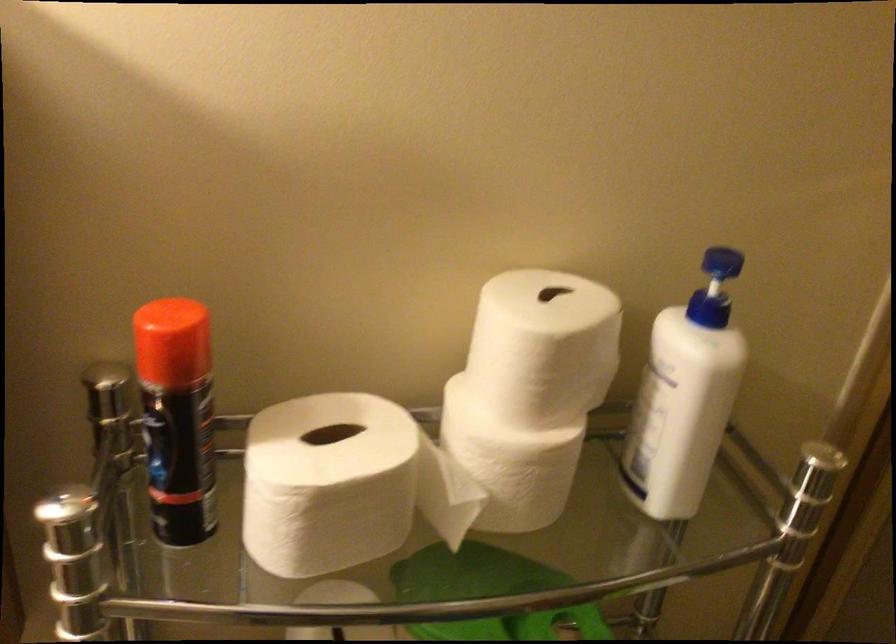
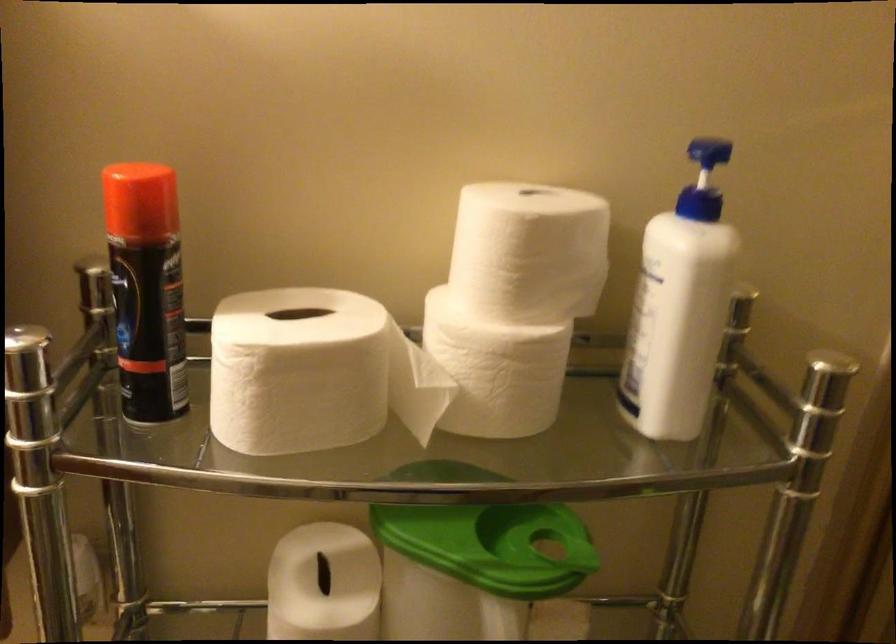
Question: The first image is from the beginning of the video and the second image is from the end. How did the camera likely rotate when shooting the video?

Choices:
 (A) Left
 (B) Right
 (C) Up
 (D) Down

Answer: (A)